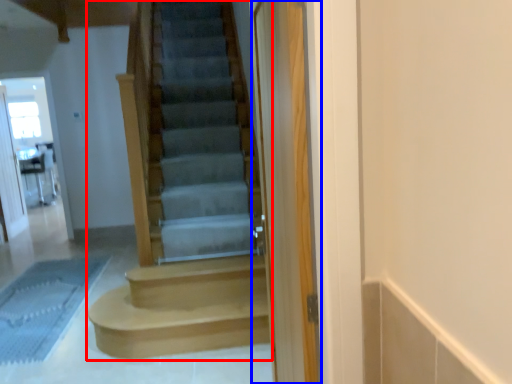
Question: Among these objects, which one is farthest to the camera, stairs (highlighted by a red box) or screen door (highlighted by a blue box)?

Choices:
 (A) stairs
 (B) screen door

Answer: (B)